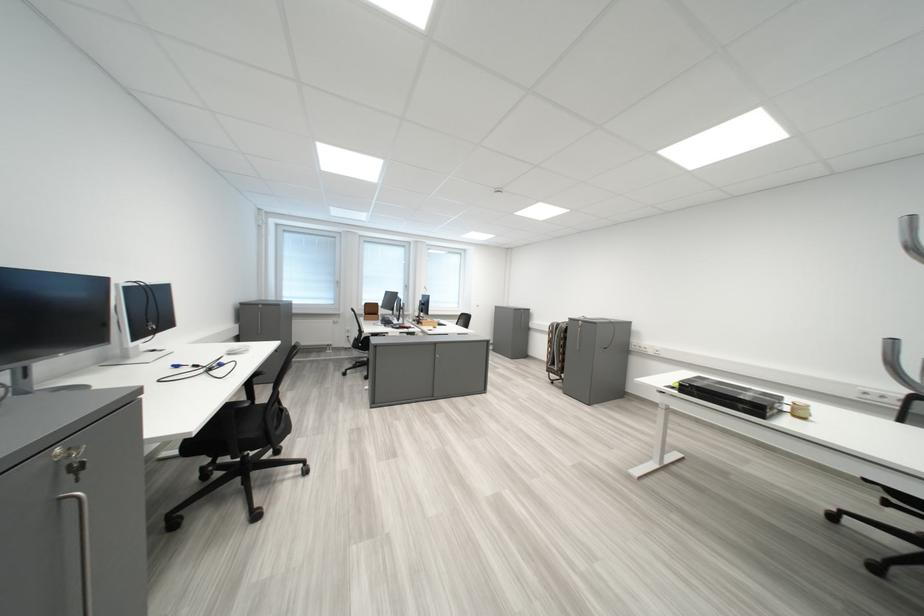
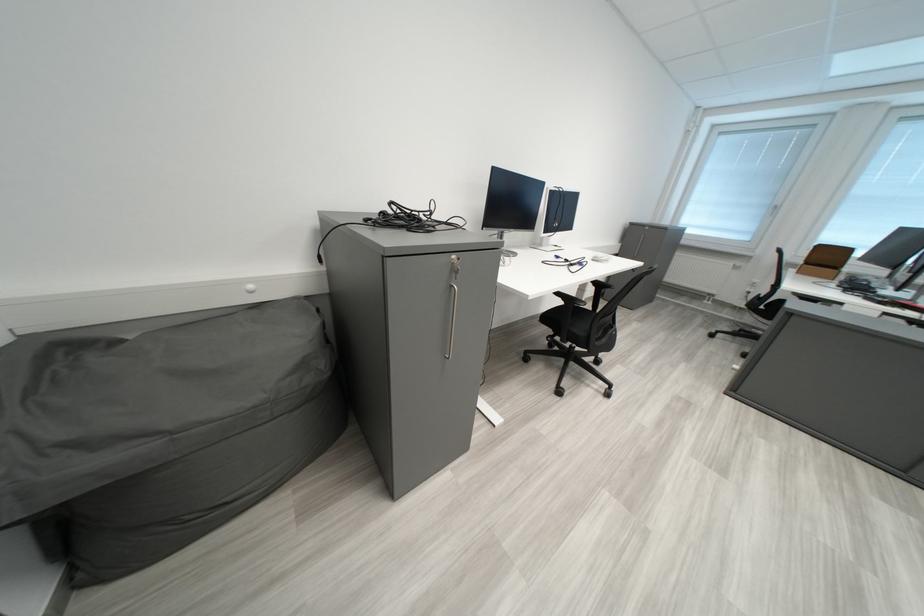
The point at [380,306] is marked in the first image. Where is the corresponding point in the second image?

(833, 249)